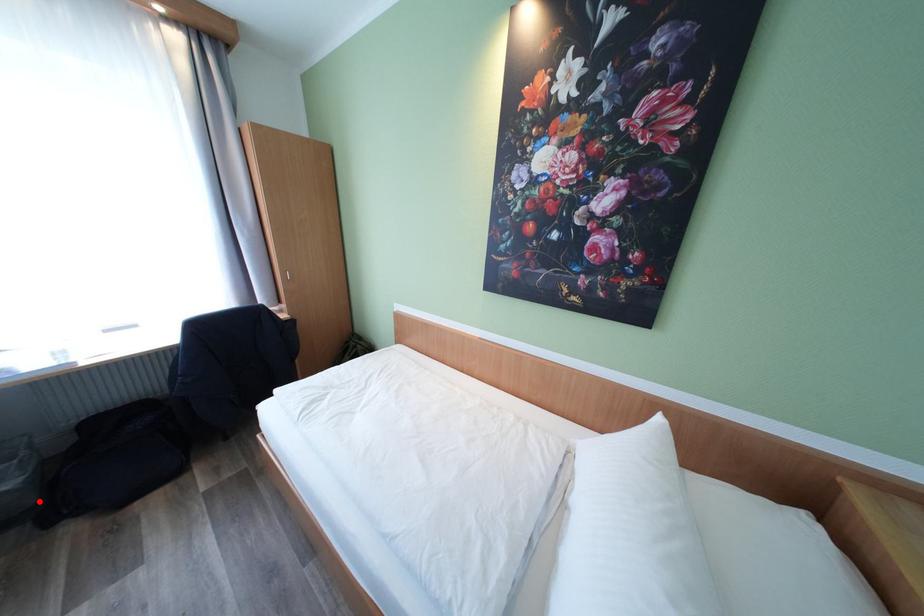
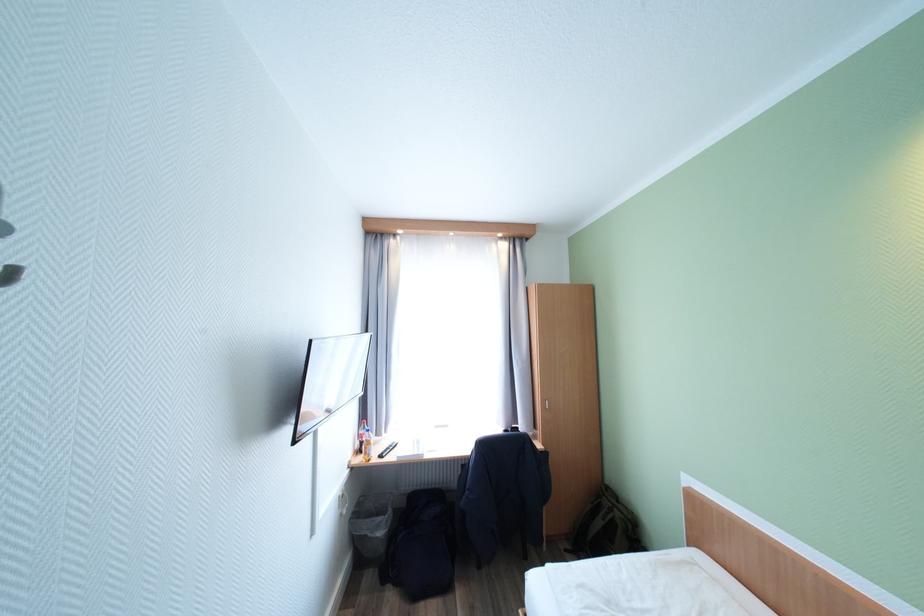
Where in the second image is the point corresponding to the highlighted location from the first image?

(390, 551)